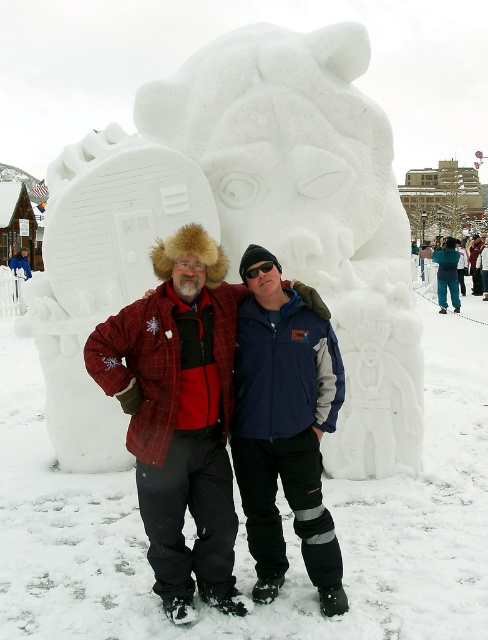
You are a photographer trying to capture a photo of the white snow sculpture at center without the plaid wool jacket at center appearing in the frame. Given that the camera has a 50mm lens, which has a field of view of about 46 degrees, can you position yourself far enough away so that the jacket is out of the frame while still capturing the entire sculpture?

The white snow sculpture at center and plaid wool jacket at center are 4.57 meters apart. With a 50mm lens having a 46 degree field of view, you would need to position yourself approximately 13 meters away to ensure the jacket is out of the frame while capturing the entire sculpture.

From the picture: You are a photographer trying to capture a photo of the snow sculpture. You want to ensure both the plaid wool jacket at center and the navy blue jacket at center are visible in the frame. Based on their positions, which jacket should you focus on first to include both in the shot?

The plaid wool jacket at center is to the left of the navy blue jacket at center. To include both in the shot, focus on the plaid wool jacket at center first as it is positioned to the left, ensuring the navy blue jacket at center remains within the frame.